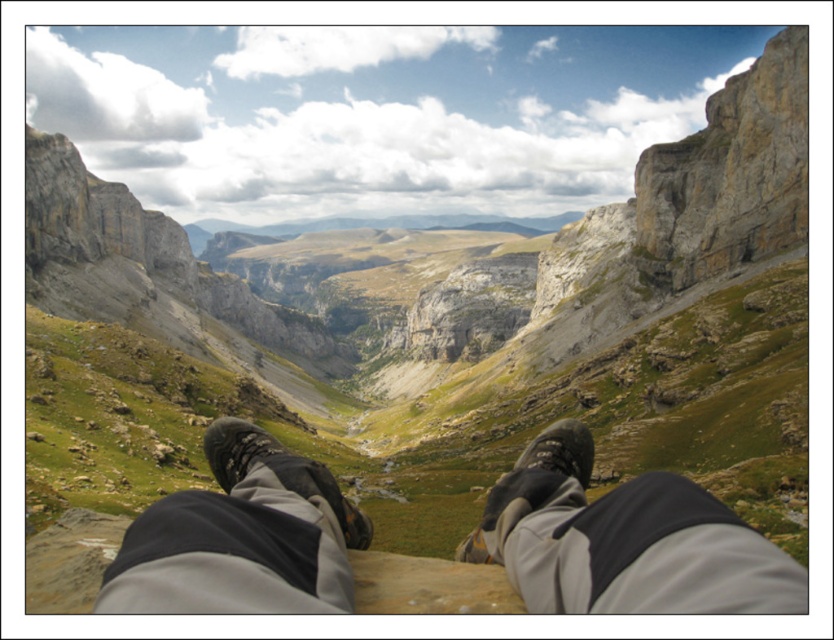
Question: Which is farther from the matte gray boot at center?

Choices:
 (A) black suede boot at lower center
 (B) gray fabric pants at lower center

Answer: (A)

Question: Which object is positioned closest to the gray fabric pants at lower center?

Choices:
 (A) black suede boot at lower center
 (B) matte gray boot at center

Answer: (A)

Question: Is gray fabric pants at lower center above black suede boot at lower center?

Choices:
 (A) no
 (B) yes

Answer: (B)

Question: Which point appears farthest from the camera in this image?

Choices:
 (A) (229, 432)
 (B) (558, 436)

Answer: (B)

Question: Is matte gray boot at center smaller than black suede boot at lower center?

Choices:
 (A) no
 (B) yes

Answer: (A)

Question: Can you confirm if gray fabric pants at lower center is smaller than matte gray boot at center?

Choices:
 (A) no
 (B) yes

Answer: (B)